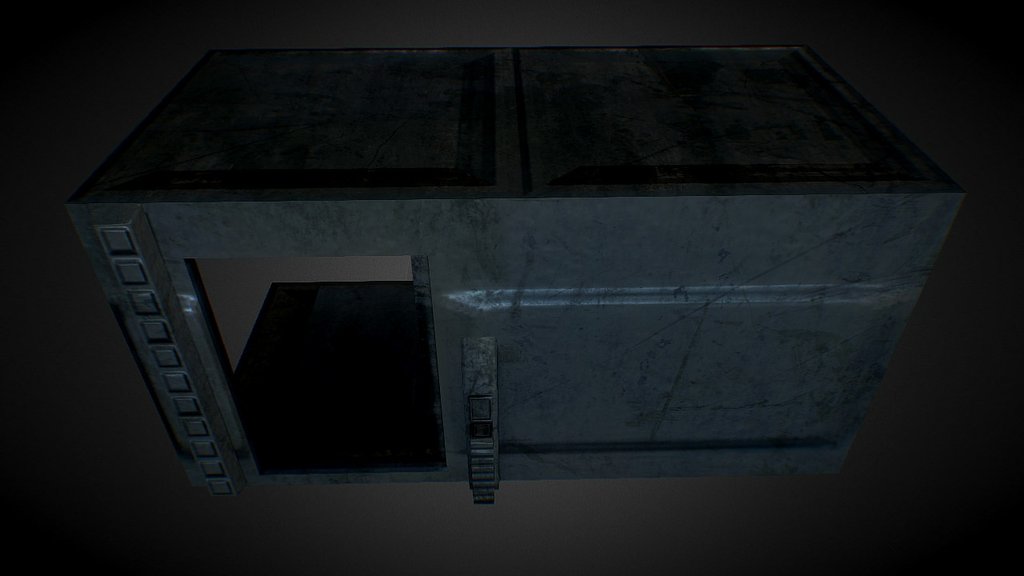
Locate an element on the screen. Image resolution: width=1024 pixels, height=576 pixels. light is located at coordinates (513, 289), (656, 304), (816, 281).